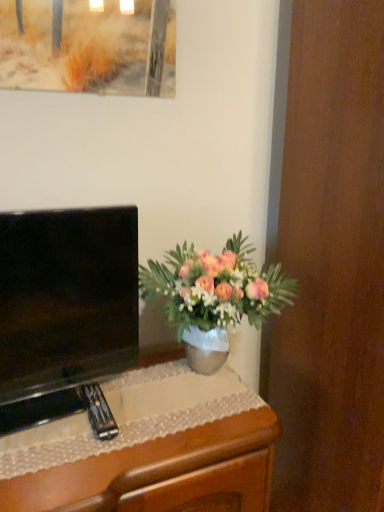
Question: Is wooden desk at lower left positioned beyond the bounds of black glossy television at left?

Choices:
 (A) yes
 (B) no

Answer: (A)

Question: Does wooden desk at lower left appear on the left side of black glossy television at left?

Choices:
 (A) no
 (B) yes

Answer: (A)

Question: Would you say black glossy television at left is part of wooden desk at lower left's contents?

Choices:
 (A) no
 (B) yes

Answer: (A)

Question: Does wooden desk at lower left have a lesser height compared to black glossy television at left?

Choices:
 (A) no
 (B) yes

Answer: (B)

Question: Does wooden desk at lower left have a larger size compared to black glossy television at left?

Choices:
 (A) yes
 (B) no

Answer: (A)

Question: Is wooden desk at lower left turned away from black glossy television at left?

Choices:
 (A) no
 (B) yes

Answer: (A)

Question: Is black glossy television at left thinner than wooden desk at lower left?

Choices:
 (A) yes
 (B) no

Answer: (A)

Question: Considering the relative sizes of black glossy television at left and wooden desk at lower left in the image provided, is black glossy television at left bigger than wooden desk at lower left?

Choices:
 (A) yes
 (B) no

Answer: (B)

Question: Considering the relative positions of black glossy television at left and wooden desk at lower left in the image provided, is black glossy television at left in front of wooden desk at lower left?

Choices:
 (A) no
 (B) yes

Answer: (A)

Question: Can you confirm if black glossy television at left is shorter than wooden desk at lower left?

Choices:
 (A) yes
 (B) no

Answer: (B)

Question: Would you say black glossy television at left contains wooden desk at lower left?

Choices:
 (A) no
 (B) yes

Answer: (A)

Question: Is black glossy television at left far away from wooden desk at lower left?

Choices:
 (A) no
 (B) yes

Answer: (A)

Question: From the image's perspective, is wooden desk at lower left above pink matte vase at center?

Choices:
 (A) no
 (B) yes

Answer: (A)